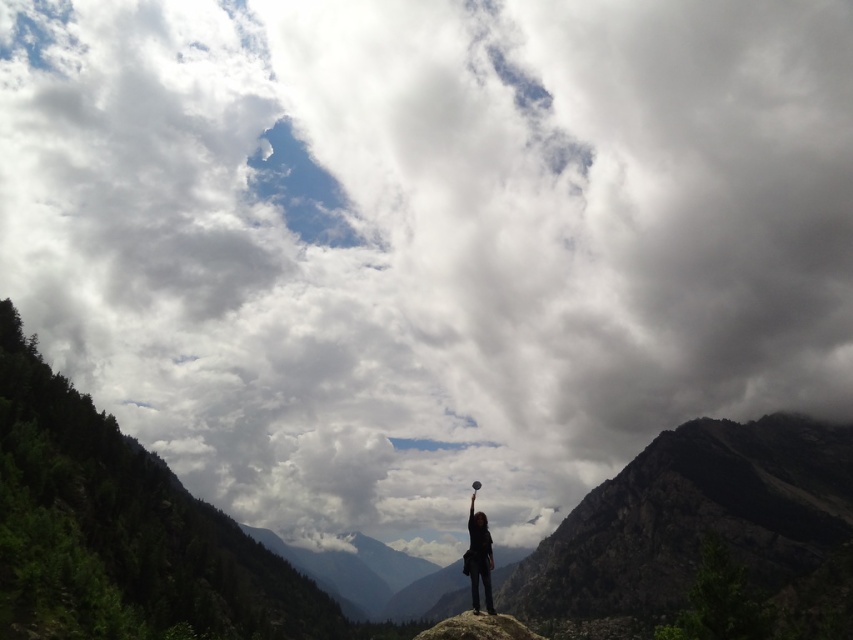
Does rugged stone mountain at center appear on the right side of gray rock at center?

Indeed, rugged stone mountain at center is positioned on the right side of gray rock at center.

Between point (618, 524) and point (503, 618), which one is positioned behind?

Point (618, 524)

The height and width of the screenshot is (640, 853). I want to click on rugged stone mountain at center, so click(694, 518).

Does gray rock at center come behind black fabric person at center?

No, gray rock at center is in front of black fabric person at center.

Between point (482, 612) and point (480, 524), which one is positioned in front?

Point (482, 612) is more forward.

Does point (514, 636) come farther from viewer compared to point (474, 570)?

No.

Where is `gray rock at center`? Image resolution: width=853 pixels, height=640 pixels. gray rock at center is located at coordinates (479, 627).

Is rugged stone mountain at center closer to the viewer compared to black fabric person at center?

No, rugged stone mountain at center is behind black fabric person at center.

Does rugged stone mountain at center appear under black fabric person at center?

Indeed, rugged stone mountain at center is positioned under black fabric person at center.

Which is behind, point (610, 566) or point (474, 493)?

The point (610, 566) is behind.

You are a GUI agent. You are given a task and a screenshot of the screen. Output one action in this format:
    pyautogui.click(x=<x>, y=<y>)
    Task: Click on the rugged stone mountain at center
    
    Given the screenshot: What is the action you would take?
    pyautogui.click(x=694, y=518)